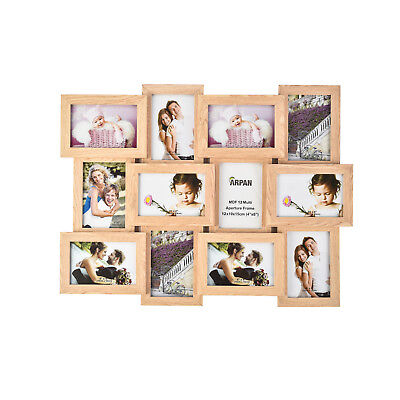
You are a GUI agent. You are given a task and a screenshot of the screen. Output one action in this format:
    pyautogui.click(x=<x>, y=<y>)
    Task: Click on the horizontal frame
    Image resolution: width=400 pixels, height=400 pixels.
    Given the screenshot: What is the action you would take?
    pyautogui.click(x=113, y=131), pyautogui.click(x=231, y=130), pyautogui.click(x=157, y=179), pyautogui.click(x=299, y=188), pyautogui.click(x=120, y=256), pyautogui.click(x=240, y=257)